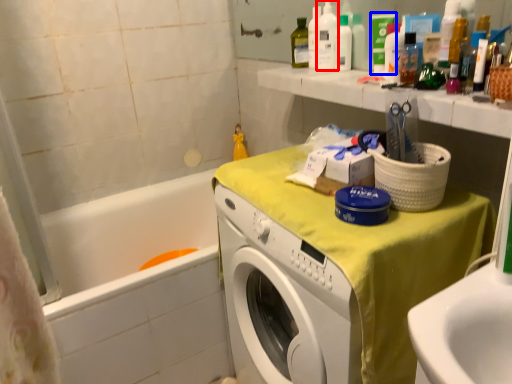
Question: Which point is closer to the camera, cleaning product (highlighted by a red box) or toiletry (highlighted by a blue box)?

Choices:
 (A) cleaning product
 (B) toiletry

Answer: (B)